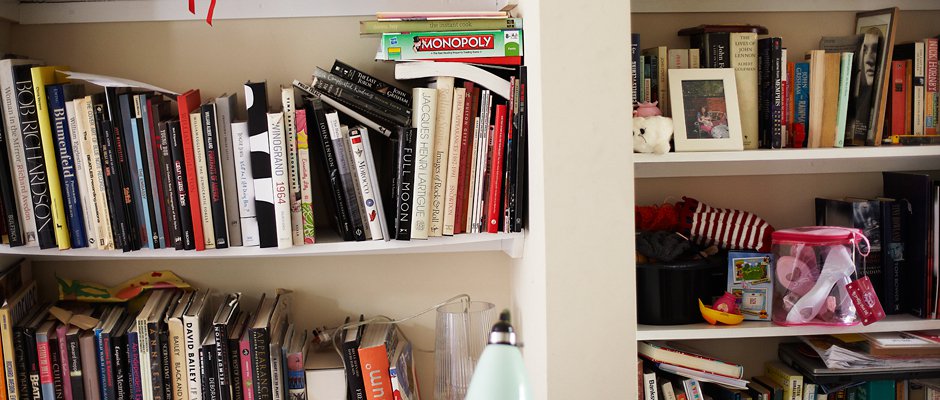
Where is `board game box`? board game box is located at coordinates (499, 45).